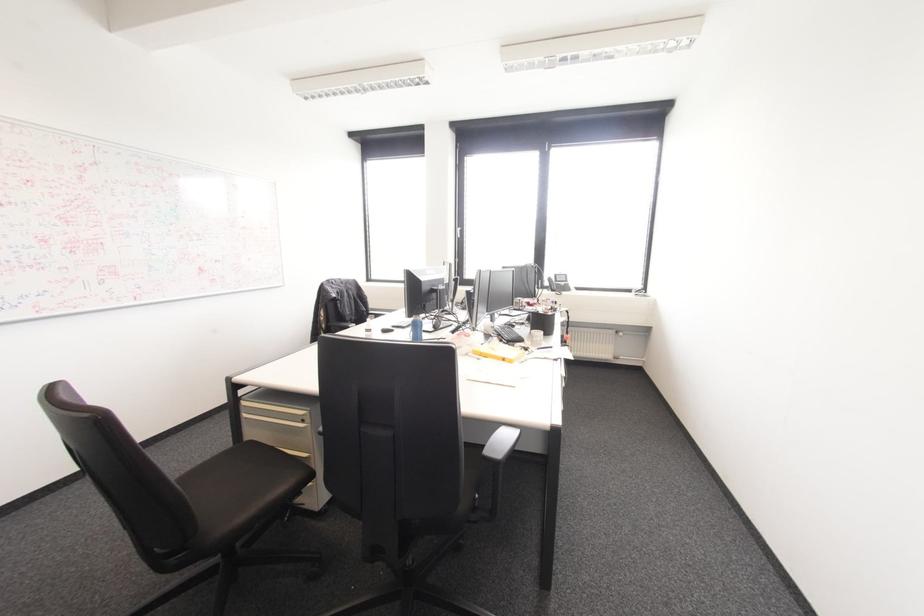
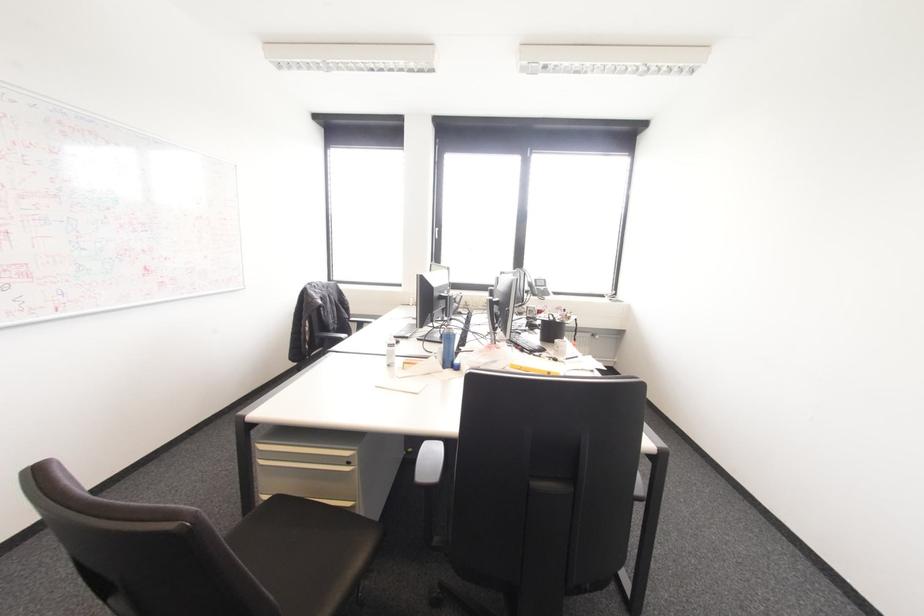
Question: Based on the continuous images, in which direction is the camera rotating? Reply with the corresponding letter.

Choices:
 (A) Left
 (B) Right
 (C) Up
 (D) Down

Answer: (B)